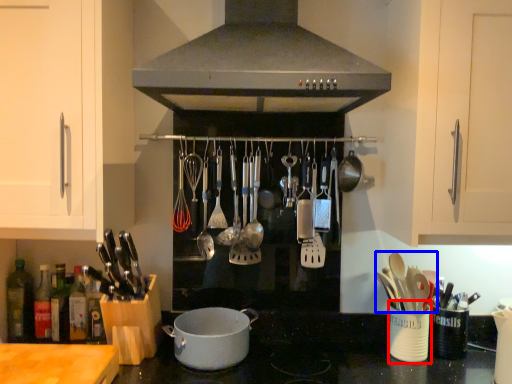
Question: Which object is closer to the camera taking this photo, appliance (highlighted by a red box) or silverware (highlighted by a blue box)?

Choices:
 (A) appliance
 (B) silverware

Answer: (B)